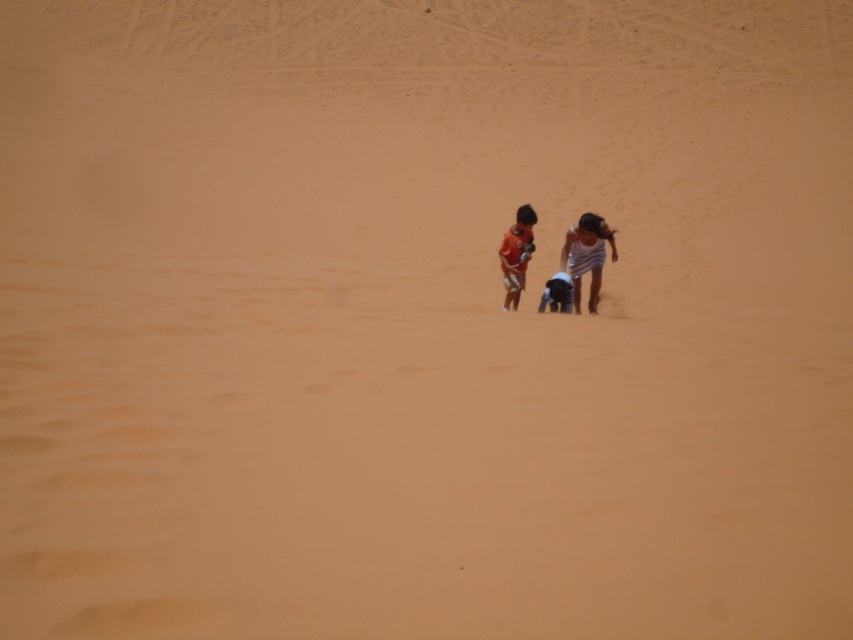
Can you confirm if white striped dress at center is smaller than orange matte shirt at center?

Actually, white striped dress at center might be larger than orange matte shirt at center.

Between point (587, 260) and point (508, 243), which one is positioned in front?

Positioned in front is point (508, 243).

Who is more distant from viewer, (595, 305) or (519, 289)?

The point (595, 305) is more distant.

Where is `white striped dress at center`? white striped dress at center is located at coordinates (585, 256).

Does orange matte shirt at center appear on the right side of matte black shorts at center?

Incorrect, orange matte shirt at center is not on the right side of matte black shorts at center.

Does orange matte shirt at center appear under matte black shorts at center?

Incorrect, orange matte shirt at center is not positioned below matte black shorts at center.

Is point (509, 262) positioned behind point (554, 278)?

Yes, it is.

Find the location of a particular element. This screenshot has height=640, width=853. orange matte shirt at center is located at coordinates (515, 253).

Can you confirm if white striped dress at center is positioned above matte black shorts at center?

Yes, white striped dress at center is above matte black shorts at center.

Is white striped dress at center closer to the viewer compared to matte black shorts at center?

Yes, it is in front of matte black shorts at center.

Between point (590, 228) and point (566, 276), which one is positioned behind?

The point (566, 276) is behind.

The image size is (853, 640). In order to click on white striped dress at center in this screenshot , I will do `click(585, 256)`.